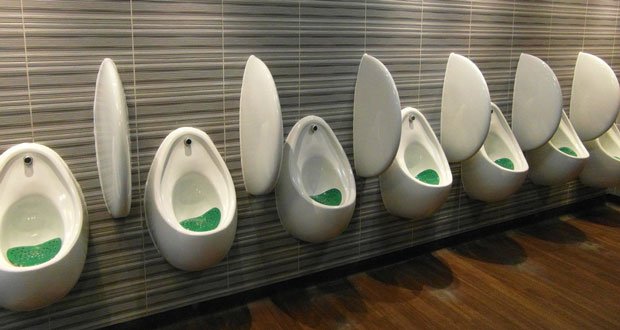
The height and width of the screenshot is (330, 620). I want to click on urinal, so click(x=56, y=222), click(x=198, y=205), click(x=316, y=163), click(x=434, y=169), click(x=503, y=159), click(x=575, y=152), click(x=601, y=160).